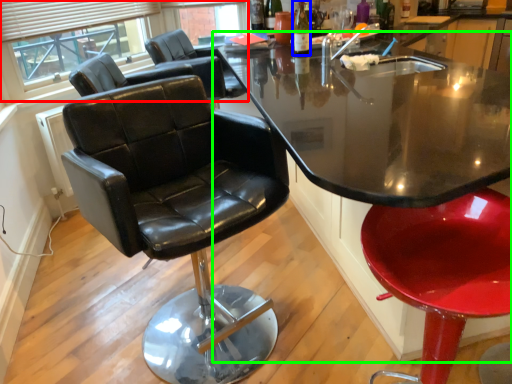
Question: Which object is positioned closest to bay window (highlighted by a red box)? Select from bottle (highlighted by a blue box) and table (highlighted by a green box).

Choices:
 (A) bottle
 (B) table

Answer: (B)